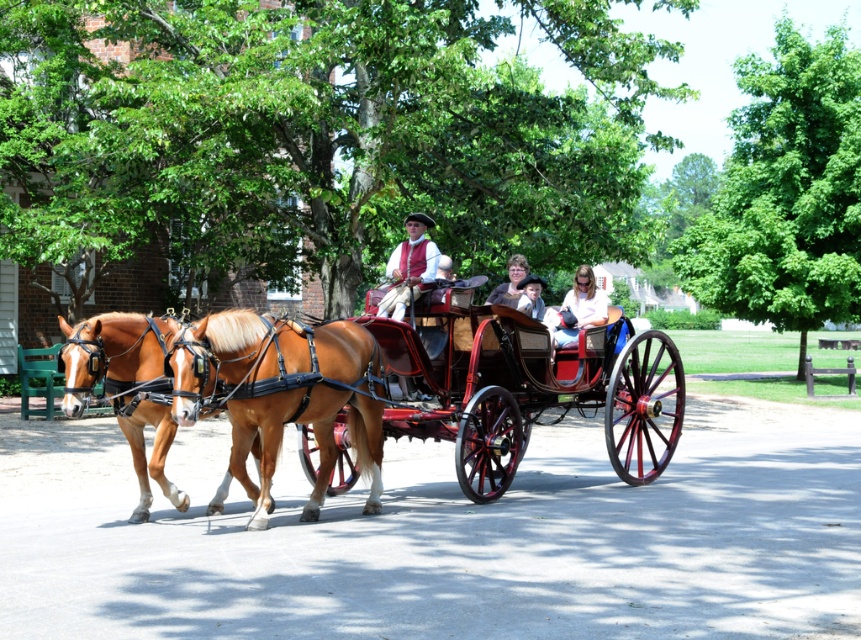
You are a photographer standing in the park and want to take a photo of the brown glossy horse at left and the smooth brown hair at center. Which object is positioned more to the left side of the image?

The brown glossy horse at left is positioned more to the left side of the image than the smooth brown hair at center.